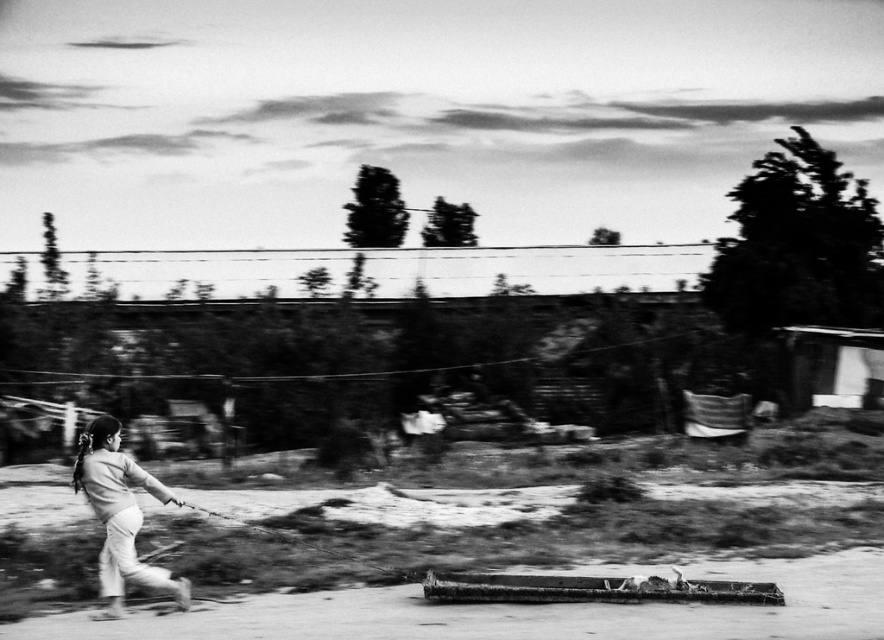
You are a photographer analyzing this image. You notice the smooth skin girl at lower left and the smooth dirt track at lower center. Based on their positions, which object is closer to the camera?

The smooth dirt track at lower center is closer to the camera because the smooth skin girl at lower left is positioned behind it.

You are a photographer analyzing this image. You need to determine if the smooth skin girl at lower left can walk across the smooth dirt track at lower center without stepping off. Based on the provided information, what do you conclude?

The smooth dirt track at lower center is wider than the smooth skin girl at lower left, so she can walk across it without stepping off.

You are a photographer standing in the scene and want to take a picture of the smooth skin girl at lower left and the smooth dirt track at lower center. Which object is positioned to the right side of the other?

The smooth dirt track at lower center is to the right of smooth skin girl at lower left.